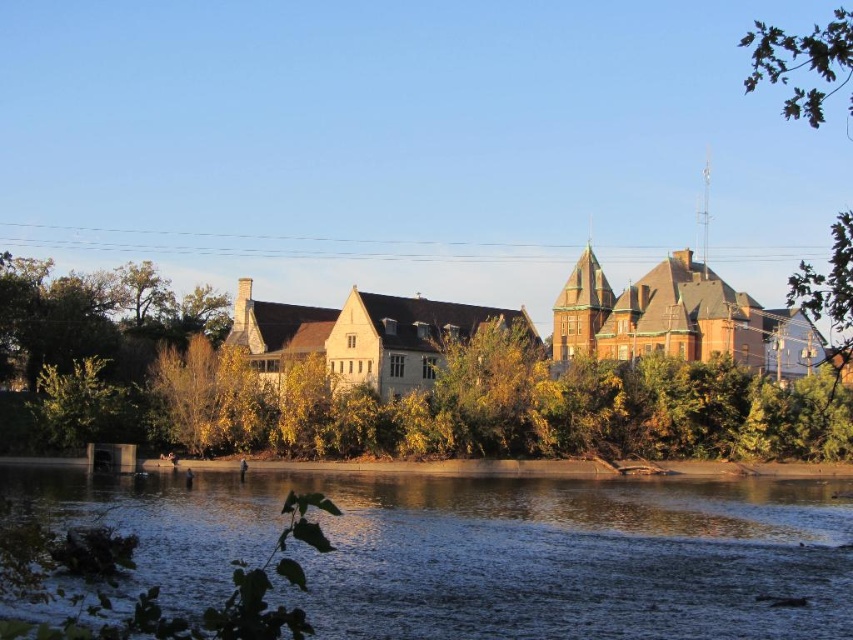
Question: Which point is farther from the camera taking this photo?

Choices:
 (A) (494, 515)
 (B) (636, 385)

Answer: (B)

Question: Where is dark blue water at lower center located in relation to green leafy tree at center in the image?

Choices:
 (A) below
 (B) above

Answer: (A)

Question: Among these objects, which one is farthest from the camera?

Choices:
 (A) dark blue water at lower center
 (B) green leafy tree at center

Answer: (B)

Question: Is dark blue water at lower center further to camera compared to green leafy tree at center?

Choices:
 (A) yes
 (B) no

Answer: (B)

Question: Does dark blue water at lower center have a smaller size compared to green leafy tree at center?

Choices:
 (A) yes
 (B) no

Answer: (A)